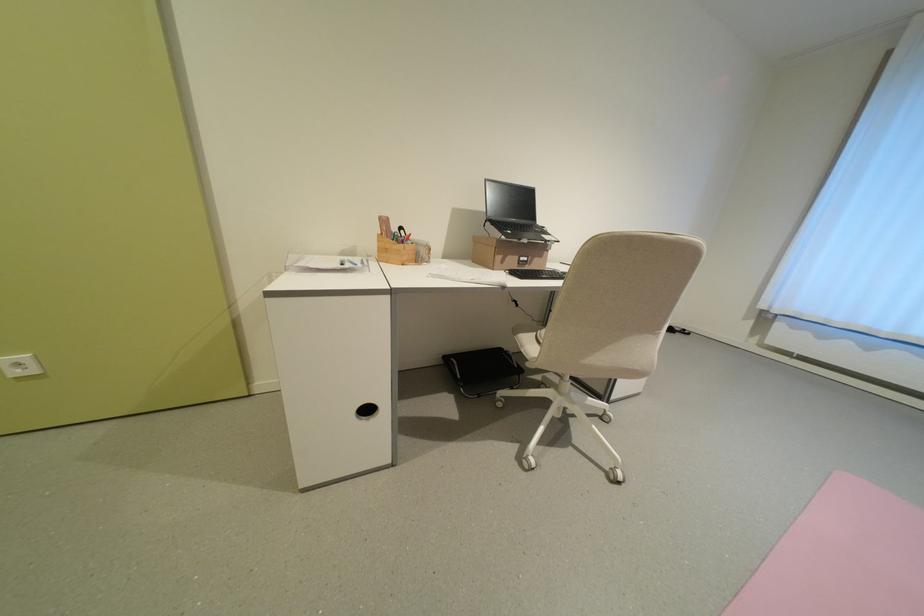
You are a GUI agent. You are given a task and a screenshot of the screen. Output one action in this format:
    pyautogui.click(x=<x>, y=<y>)
    Task: Click on the clear paper tray
    
    Given the screenshot: What is the action you would take?
    pyautogui.click(x=325, y=259)